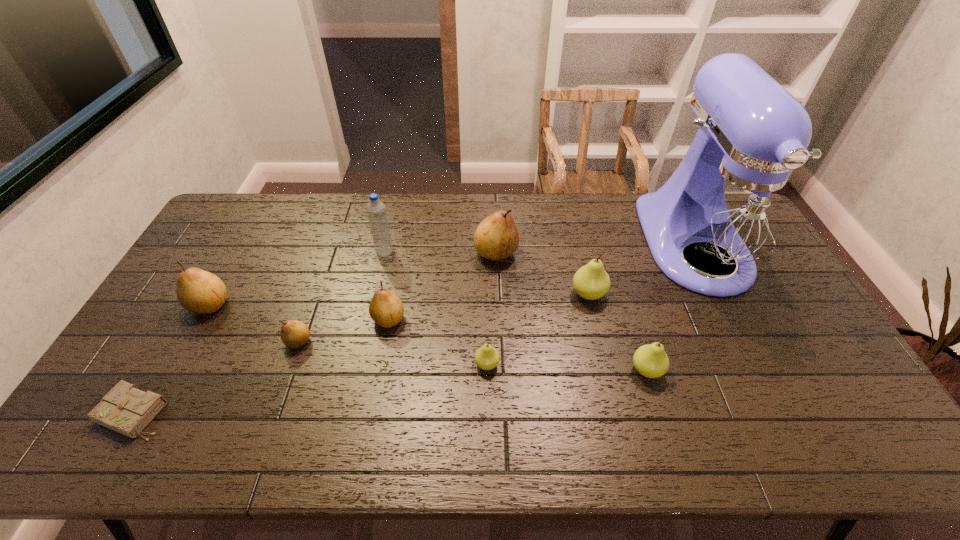
I want to click on pear that can be found as the fourth closest to the sixth pear from right to left, so click(x=496, y=237).

Locate an element on the screen. Image resolution: width=960 pixels, height=540 pixels. pear that is the fifth closest to the smallest green pear is located at coordinates [x=294, y=334].

Identify which brown pear is the nearest to the leftmost brown pear. Please provide its 2D coordinates. Your answer should be formatted as a tuple, i.e. [(x, y)], where the tuple contains the x and y coordinates of a point satisfying the conditions above.

[(294, 334)]

Locate an element on the screen. This screenshot has height=540, width=960. the closest brown pear to the third pear from left to right is located at coordinates (294, 334).

Identify which green pear is the closest to the second pear from right to left. Please provide its 2D coordinates. Your answer should be formatted as a tuple, i.e. [(x, y)], where the tuple contains the x and y coordinates of a point satisfying the conditions above.

[(650, 360)]

Choose which green pear is the nearest neighbor to the rightmost object. Please provide its 2D coordinates. Your answer should be formatted as a tuple, i.e. [(x, y)], where the tuple contains the x and y coordinates of a point satisfying the conditions above.

[(591, 282)]

At what (x,y) coordinates should I click in order to perform the action: click on vacant space that satisfies the following two spatial constraints: 1. on the back side of the biggest green pear; 2. on the right side of the leftmost green pear. Please return your answer as a coordinate pair (x, y). The image size is (960, 540). Looking at the image, I should click on (487, 294).